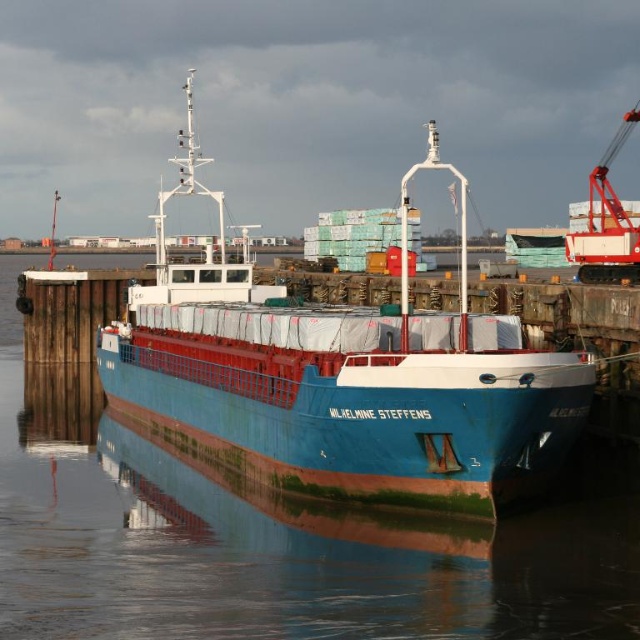
You are standing on the wooden pier and want to locate the point at coordinates (282,538). According to the scene description, where is this point located?

The point at coordinates (282,538) is on the blue glossy water at center, so it is located on the water surface near the central area of the image.

You are standing on the wooden pier and looking at the ship. There are two points marked on the ship. Which point is closer to you, point (212, 584) or point (314, 460)?

Point (212, 584) is closer to you than point (314, 460) because it is closer to the camera.